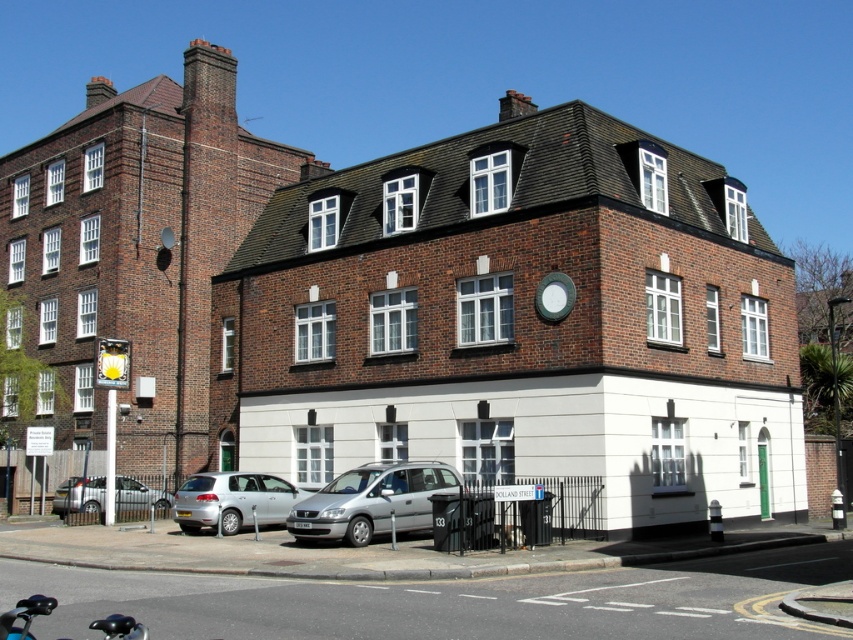
Question: From the image, what is the correct spatial relationship of silver metallic van at center in relation to silver metallic hatchback at lower left?

Choices:
 (A) above
 (B) below

Answer: (A)

Question: Which of the following is the closest to the observer?

Choices:
 (A) (100, 486)
 (B) (416, 529)
 (C) (97, 625)
 (D) (289, 508)

Answer: (C)

Question: Is silver metallic van at center further to camera compared to silver metallic van at lower left?

Choices:
 (A) yes
 (B) no

Answer: (B)

Question: Among these objects, which one is farthest from the camera?

Choices:
 (A) silver metallic van at lower left
 (B) silver metallic van at center
 (C) blue matte motorcycle at lower left
 (D) silver metallic hatchback at lower left

Answer: (A)

Question: Can you confirm if silver metallic van at lower left is wider than blue matte motorcycle at lower left?

Choices:
 (A) yes
 (B) no

Answer: (B)

Question: Among these points, which one is farthest from the camera?

Choices:
 (A) (283, 504)
 (B) (93, 483)

Answer: (B)